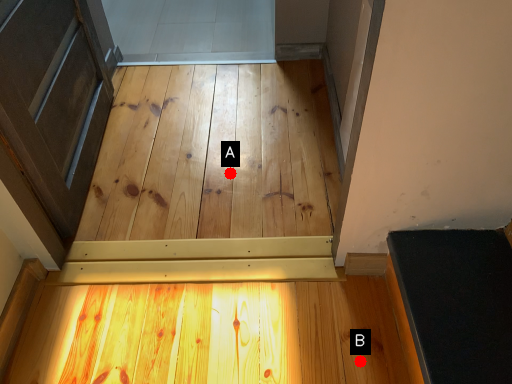
Question: Two points are circled on the image, labeled by A and B beside each circle. Which of the following is the farthest from the observer?

Choices:
 (A) A is further
 (B) B is further

Answer: (A)